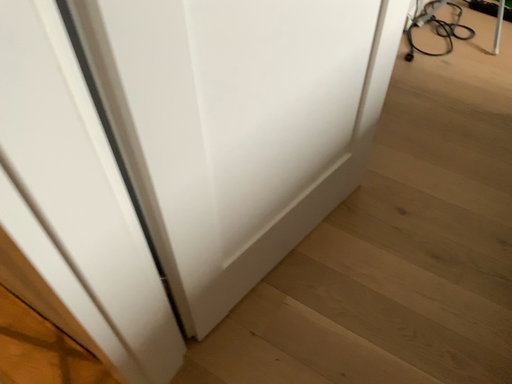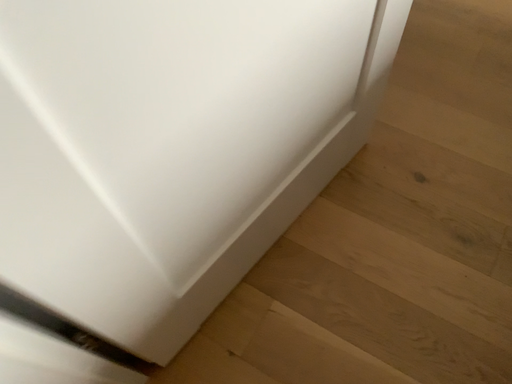
Question: Which way did the camera rotate in the video?

Choices:
 (A) rotated downward
 (B) rotated upward

Answer: (A)